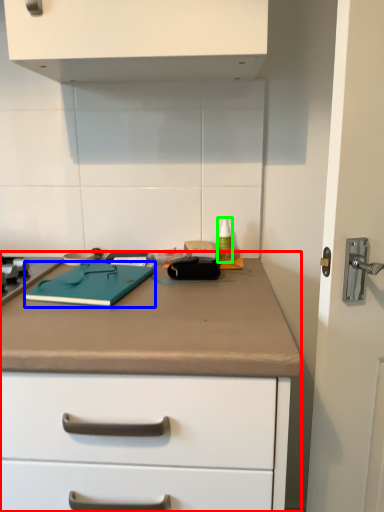
Question: Estimate the real-world distances between objects in this image. Which object is farther from counter (highlighted by a red box), notebook (highlighted by a blue box) or bottle (highlighted by a green box)?

Choices:
 (A) notebook
 (B) bottle

Answer: (B)